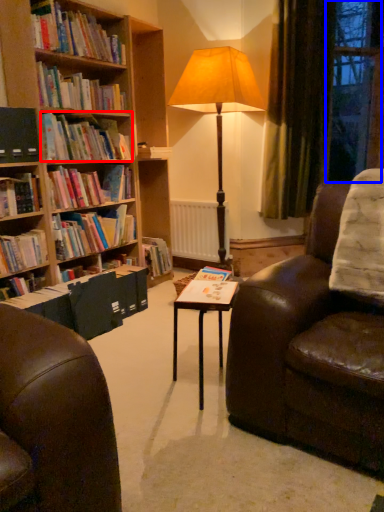
Question: Which point is further to the camera, book (highlighted by a red box) or window (highlighted by a blue box)?

Choices:
 (A) book
 (B) window

Answer: (B)